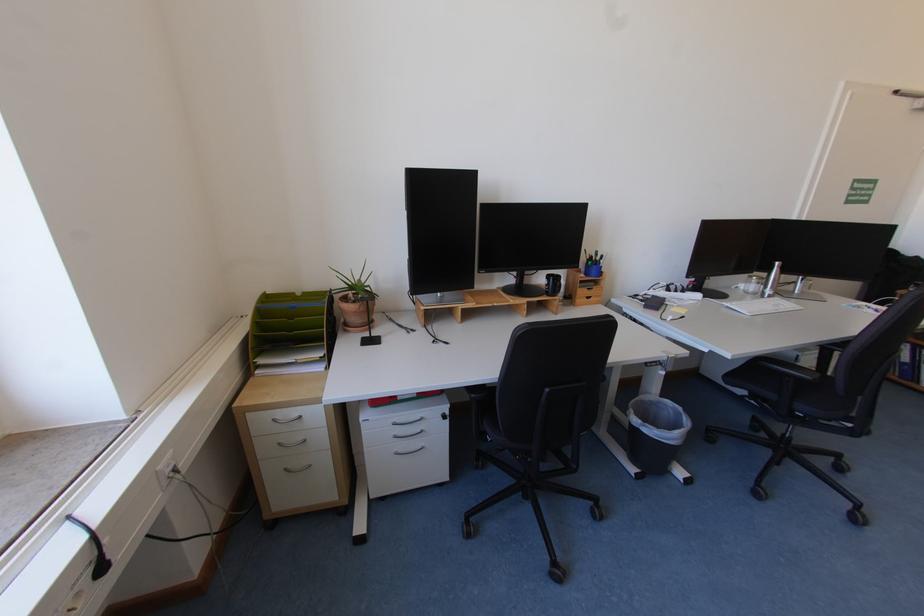
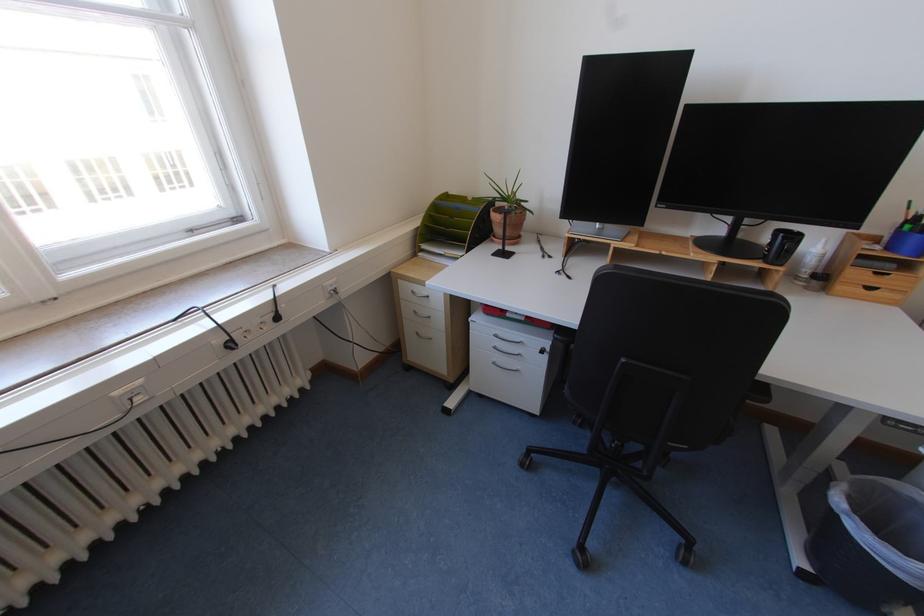
Find the pixel in the second image that matches (594,276) in the first image.

(896, 249)